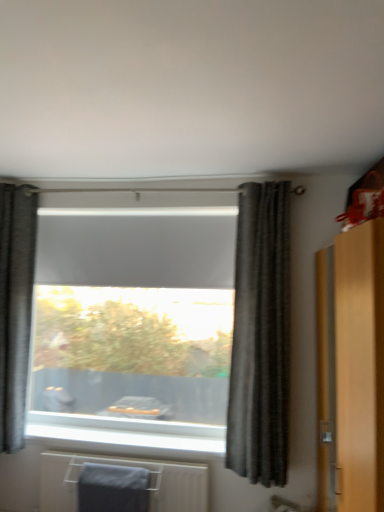
Question: From the image's perspective, would you say dark gray textured curtain at left, arranged as the second curtain when viewed from the right, is shown under gray fabric bath towel at lower left?

Choices:
 (A) yes
 (B) no

Answer: (B)

Question: Can you confirm if dark gray textured curtain at left, which is counted as the second curtain, starting from the front, is wider than gray fabric bath towel at lower left?

Choices:
 (A) no
 (B) yes

Answer: (B)

Question: Is dark gray textured curtain at left, marked as the 1th curtain in a back-to-front arrangement, far away from gray fabric bath towel at lower left?

Choices:
 (A) yes
 (B) no

Answer: (B)

Question: Does dark gray textured curtain at left, the first curtain positioned from the left, have a smaller size compared to gray fabric bath towel at lower left?

Choices:
 (A) yes
 (B) no

Answer: (B)

Question: Does dark gray textured curtain at left, which is counted as the second curtain, starting from the front, turn towards gray fabric bath towel at lower left?

Choices:
 (A) no
 (B) yes

Answer: (A)

Question: From a real-world perspective, is dark gray textured curtain at left, the first curtain positioned from the left, physically above gray fabric bath towel at lower left?

Choices:
 (A) no
 (B) yes

Answer: (B)

Question: Does dark gray textured curtain at center, which is the second curtain from back to front, turn towards gray matte towel at lower center?

Choices:
 (A) yes
 (B) no

Answer: (B)

Question: Is dark gray textured curtain at center, placed as the 2th curtain when sorted from left to right, not near gray matte towel at lower center?

Choices:
 (A) yes
 (B) no

Answer: (B)

Question: From the image's perspective, would you say dark gray textured curtain at center, which is the second curtain from back to front, is positioned over gray matte towel at lower center?

Choices:
 (A) yes
 (B) no

Answer: (A)

Question: Can gray matte towel at lower center be found inside dark gray textured curtain at center, acting as the first curtain starting from the front?

Choices:
 (A) yes
 (B) no

Answer: (B)

Question: Is dark gray textured curtain at center, which appears as the first curtain when viewed from the right, turned away from gray matte towel at lower center?

Choices:
 (A) no
 (B) yes

Answer: (A)

Question: Considering the relative sizes of dark gray textured curtain at center, which is the second curtain from back to front, and gray matte towel at lower center in the image provided, is dark gray textured curtain at center, which is the second curtain from back to front, thinner than gray matte towel at lower center?

Choices:
 (A) yes
 (B) no

Answer: (A)

Question: Is matte wooden dresser at right next to dark gray textured curtain at center, which is the second curtain from back to front, and touching it?

Choices:
 (A) yes
 (B) no

Answer: (B)